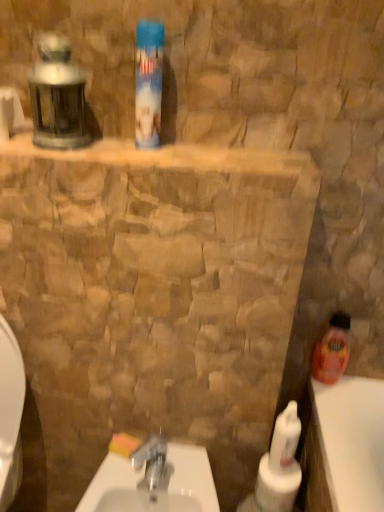
What are the coordinates of `spots to the right of blue plastic can at upper center, the 1th cleaning product from the top` in the screenshot? It's located at (209, 153).